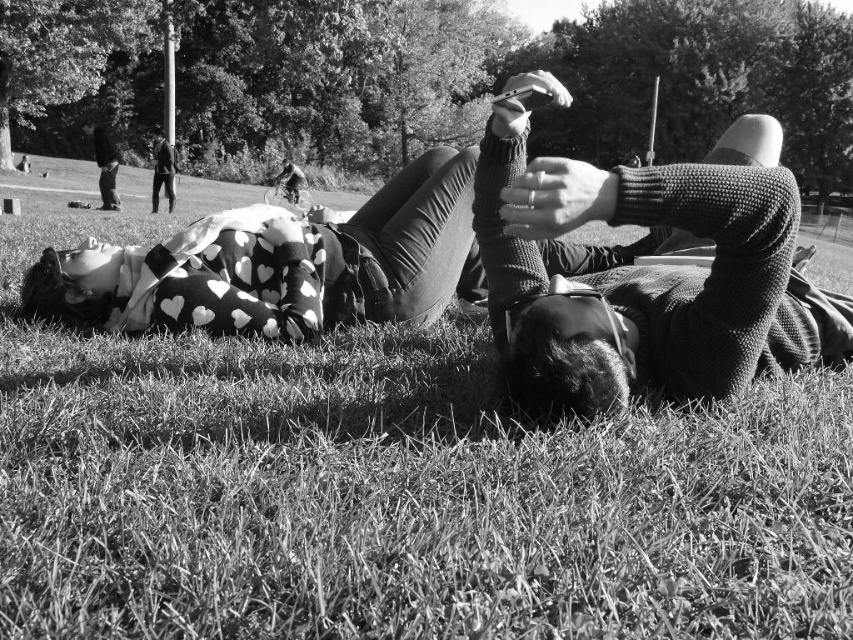
Question: Does knitted sweater at center have a greater width compared to dark gray suit at upper left?

Choices:
 (A) no
 (B) yes

Answer: (B)

Question: Considering the relative positions of knitted sweater at center and dark gray suit at upper left in the image provided, where is knitted sweater at center located with respect to dark gray suit at upper left?

Choices:
 (A) right
 (B) left

Answer: (A)

Question: Is knitted sweater at center wider than dark gray suit at upper left?

Choices:
 (A) yes
 (B) no

Answer: (A)

Question: Which point appears closest to the camera in this image?

Choices:
 (A) (622, 218)
 (B) (157, 184)

Answer: (A)

Question: Which point is farther to the camera?

Choices:
 (A) (796, 365)
 (B) (166, 156)

Answer: (B)